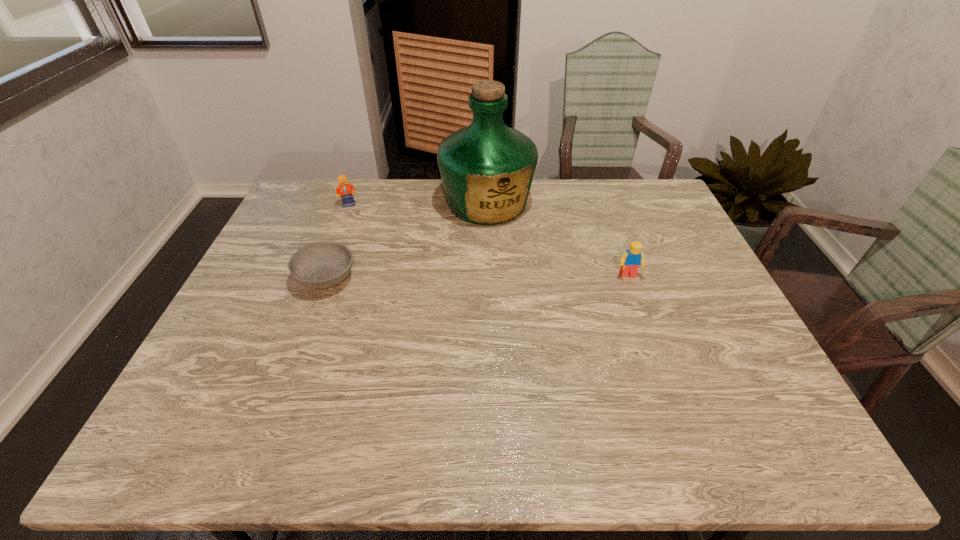
I want to click on the shortest object, so click(320, 265).

Locate an element on the screen. the nearer Lego is located at coordinates (631, 260).

The height and width of the screenshot is (540, 960). What are the coordinates of `the right Lego` in the screenshot? It's located at (631, 260).

The image size is (960, 540). In order to click on the left Lego in this screenshot , I will do `click(345, 189)`.

Where is `the tallest object`? the tallest object is located at coordinates (487, 168).

The height and width of the screenshot is (540, 960). I want to click on the third object from left to right, so click(x=487, y=168).

Locate an element on the screen. This screenshot has height=540, width=960. vacant space located 0.300m on the right of the bowl is located at coordinates (465, 278).

Identify the location of vacant space located on the front-facing side of the rightmost object. (645, 321).

Where is `free space located on the front-facing side of the left Lego`? The width and height of the screenshot is (960, 540). free space located on the front-facing side of the left Lego is located at coordinates (407, 252).

Identify the location of free space located 0.300m on the front-facing side of the left Lego. The height and width of the screenshot is (540, 960). (405, 250).